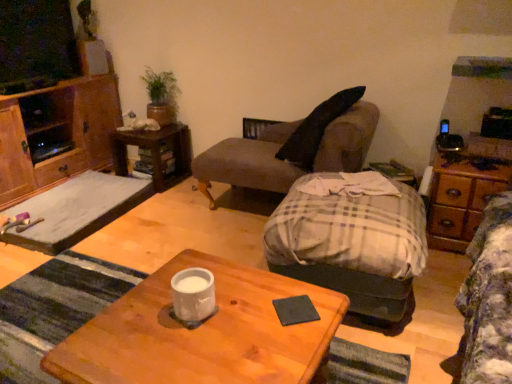
Image resolution: width=512 pixels, height=384 pixels. What do you see at coordinates (66, 135) in the screenshot? I see `wooden cabinet at left` at bounding box center [66, 135].

What do you see at coordinates (293, 148) in the screenshot? I see `gray fabric couch at center, placed as the 1th studio couch when sorted from back to front` at bounding box center [293, 148].

The height and width of the screenshot is (384, 512). Describe the element at coordinates (394, 172) in the screenshot. I see `wooden side table at center, positioned as the 2th side table in left-to-right order` at that location.

Describe the element at coordinates (461, 200) in the screenshot. Image resolution: width=512 pixels, height=384 pixels. I see `wooden dresser at right` at that location.

I want to click on green matte plant at upper left, so click(x=161, y=96).

Identify the location of wooden cabinet at left. Image resolution: width=512 pixels, height=384 pixels. [x=66, y=135].

Considering the relative sizes of gray fabric couch at center, positioned as the 2th studio couch in front-to-back order, and green matte plant at upper left in the image provided, is gray fabric couch at center, positioned as the 2th studio couch in front-to-back order, taller than green matte plant at upper left?

Indeed, gray fabric couch at center, positioned as the 2th studio couch in front-to-back order, has a greater height compared to green matte plant at upper left.

Which object is positioned more to the left, gray fabric couch at center, placed as the 1th studio couch when sorted from back to front, or green matte plant at upper left?

From the viewer's perspective, green matte plant at upper left appears more on the left side.

Is gray fabric couch at center, placed as the 1th studio couch when sorted from back to front, aimed at green matte plant at upper left?

No, gray fabric couch at center, placed as the 1th studio couch when sorted from back to front, is not facing towards green matte plant at upper left.

In terms of size, does gray fabric couch at center, positioned as the 2th studio couch in front-to-back order, appear bigger or smaller than green matte plant at upper left?

In the image, gray fabric couch at center, positioned as the 2th studio couch in front-to-back order, appears to be larger than green matte plant at upper left.

From a real-world perspective, is brown wood side table at upper left, the first side table in the left-to-right sequence, below green matte plant at upper left?

Correct, in the physical world, brown wood side table at upper left, the first side table in the left-to-right sequence, is lower than green matte plant at upper left.

Is green matte plant at upper left a part of brown wood side table at upper left, positioned as the 2th side table in right-to-left order?

Actually, green matte plant at upper left is outside brown wood side table at upper left, positioned as the 2th side table in right-to-left order.

Which of these two, brown wood side table at upper left, the first side table in the left-to-right sequence, or green matte plant at upper left, is thinner?

green matte plant at upper left is thinner.

Does point (44, 238) come in front of point (452, 205)?

No, it is not.

Does smooth gray mat at left have a lesser height compared to wooden dresser at right?

Yes, smooth gray mat at left is shorter than wooden dresser at right.

Is smooth gray mat at left looking in the opposite direction of wooden dresser at right?

smooth gray mat at left does not have its back to wooden dresser at right.

This screenshot has height=384, width=512. I want to click on flat on the left of the wooden dresser at right, so click(x=76, y=210).

Is brown wood side table at upper left, which is the first side table in back-to-front order, completely or partially outside of wooden side table at center, the 1th side table from the right?

Indeed, brown wood side table at upper left, which is the first side table in back-to-front order, is completely outside wooden side table at center, the 1th side table from the right.

Is point (135, 141) closer or farther from the camera than point (415, 184)?

Point (135, 141) is farther from the camera than point (415, 184).

From a real-world perspective, which is physically above, brown wood side table at upper left, the first side table in the left-to-right sequence, or wooden side table at center, the first side table from the front?

From a 3D spatial view, wooden side table at center, the first side table from the front, is above.

Between brown wood side table at upper left, positioned as the 2th side table in right-to-left order, and wooden side table at center, the first side table from the front, which one appears on the right side from the viewer's perspective?

From the viewer's perspective, wooden side table at center, the first side table from the front, appears more on the right side.

From a real-world perspective, is wooden dresser at right positioned above or below brown wood side table at upper left, which is the first side table in back-to-front order?

Clearly, from a real-world perspective, wooden dresser at right is above brown wood side table at upper left, which is the first side table in back-to-front order.

Does wooden dresser at right turn towards brown wood side table at upper left, the first side table in the left-to-right sequence?

No, wooden dresser at right does not turn towards brown wood side table at upper left, the first side table in the left-to-right sequence.

Where is `dresser located underneath the wooden side table at center, positioned as the 2th side table in back-to-front order (from a real-world perspective)`? dresser located underneath the wooden side table at center, positioned as the 2th side table in back-to-front order (from a real-world perspective) is located at coordinates (461, 200).

Looking at this image, which of these two, wooden dresser at right or wooden side table at center, the 1th side table from the right, is smaller?

Smaller between the two is wooden side table at center, the 1th side table from the right.

Is wooden dresser at right turned away from wooden side table at center, the 1th side table from the right?

wooden dresser at right does not have its back to wooden side table at center, the 1th side table from the right.

Is black matte coaster at center completely or partially outside of wooden desk at center?

Actually, black matte coaster at center is within wooden desk at center.

Which object is further away from the camera, black matte coaster at center or wooden desk at center?

black matte coaster at center is further from the camera.

How much distance is there between black matte coaster at center and wooden desk at center?

black matte coaster at center is 8.86 inches from wooden desk at center.

Can you confirm if black matte coaster at center is smaller than wooden desk at center?

Yes, black matte coaster at center is smaller than wooden desk at center.

Where is `the 1st studio couch below when counting from the green matte plant at upper left (from the image's perspective)`? the 1st studio couch below when counting from the green matte plant at upper left (from the image's perspective) is located at coordinates (293, 148).

Where is `houseplant above the brown wood side table at upper left, which is the first side table in back-to-front order (from the image's perspective)`? The height and width of the screenshot is (384, 512). houseplant above the brown wood side table at upper left, which is the first side table in back-to-front order (from the image's perspective) is located at coordinates (161, 96).

Based on their spatial positions, is plaid fabric ottoman at center, the second studio couch positioned from the back, or green matte plant at upper left further from brown wood side table at upper left, the first side table in the left-to-right sequence?

plaid fabric ottoman at center, the second studio couch positioned from the back.

Looking at the image, which one is located further to wooden desk at center, smooth gray mat at left or gray fabric couch at center, placed as the 1th studio couch when sorted from back to front?

smooth gray mat at left lies further to wooden desk at center than the other object.

Looking at the image, which one is located further to green matte plant at upper left, matte black television at upper left or gray fabric couch at center, positioned as the 2th studio couch in front-to-back order?

gray fabric couch at center, positioned as the 2th studio couch in front-to-back order, is positioned further to the anchor green matte plant at upper left.

When comparing their distances from matte black television at upper left, does plaid fabric ottoman at center, placed as the first studio couch when sorted from front to back, or green matte plant at upper left seem further?

Among the two, plaid fabric ottoman at center, placed as the first studio couch when sorted from front to back, is located further to matte black television at upper left.

From the picture: When comparing their distances from black matte coaster at center, does matte black television at upper left or wooden desk at center seem closer?

The object closer to black matte coaster at center is wooden desk at center.

Looking at the image, which one is located further to wooden cabinet at left, brown wood side table at upper left, placed as the second side table when sorted from front to back, or wooden desk at center?

wooden desk at center is positioned further to the anchor wooden cabinet at left.

From the picture: Looking at the image, which one is located further to green matte plant at upper left, wooden cabinet at left or wooden side table at center, the 1th side table from the right?

wooden side table at center, the 1th side table from the right, is further to green matte plant at upper left.

Considering their positions, is wooden side table at center, the first side table from the front, positioned further to plaid fabric ottoman at center, placed as the first studio couch when sorted from front to back, than black matte coaster at center?

wooden side table at center, the first side table from the front, lies further to plaid fabric ottoman at center, placed as the first studio couch when sorted from front to back, than the other object.

This screenshot has height=384, width=512. Identify the location of television located between wooden cabinet at left and wooden side table at center, positioned as the 2th side table in left-to-right order, in the left-right direction. (36, 45).

Locate an element on the screen. The image size is (512, 384). studio couch situated between smooth gray mat at left and plaid fabric ottoman at center, placed as the first studio couch when sorted from front to back, from left to right is located at coordinates (293, 148).

This screenshot has height=384, width=512. Identify the location of houseplant located between smooth gray mat at left and plaid fabric ottoman at center, placed as the first studio couch when sorted from front to back, in the left-right direction. (161, 96).

At what (x,y) coordinates should I click in order to perform the action: click on pad positioned between wooden desk at center and gray fabric couch at center, placed as the 1th studio couch when sorted from back to front, from near to far. Please return your answer as a coordinate pair (x, y). The width and height of the screenshot is (512, 384). Looking at the image, I should click on (295, 310).